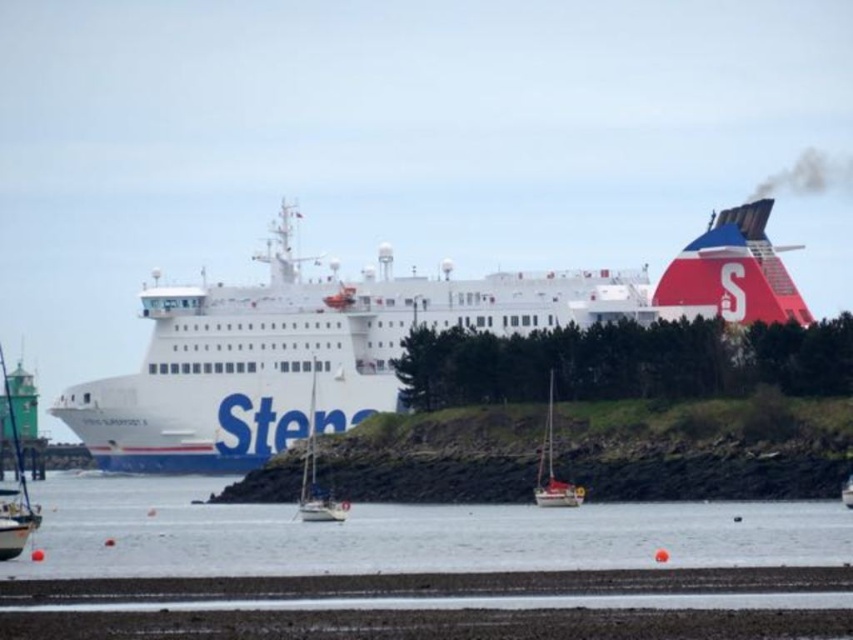
Between point (558, 285) and point (9, 556), which one is positioned in front?

Point (9, 556) is in front.

Is white matte cargo ship at center positioned before green painted wood boat at left?

No.

Is point (173, 358) farther from camera compared to point (15, 531)?

Yes.

At what (x,y) coordinates should I click in order to perform the action: click on white matte cargo ship at center. Please return your answer as a coordinate pair (x, y). Image resolution: width=853 pixels, height=640 pixels. Looking at the image, I should click on (373, 340).

Does white matte cargo ship at center appear on the left side of clear water at center?

Incorrect, white matte cargo ship at center is not on the left side of clear water at center.

Is white matte cargo ship at center in front of clear water at center?

No, white matte cargo ship at center is further to the viewer.

The height and width of the screenshot is (640, 853). What do you see at coordinates (373, 340) in the screenshot?
I see `white matte cargo ship at center` at bounding box center [373, 340].

Locate an element on the screen. This screenshot has height=640, width=853. white matte cargo ship at center is located at coordinates (373, 340).

Is point (271, 317) behind point (558, 500)?

Yes, it is behind point (558, 500).

Image resolution: width=853 pixels, height=640 pixels. Find the location of `white matte cargo ship at center`. white matte cargo ship at center is located at coordinates (373, 340).

Between point (73, 419) and point (538, 490), which one is positioned behind?

The point (73, 419) is behind.

Identify the location of white matte cargo ship at center. This screenshot has height=640, width=853. (x=373, y=340).